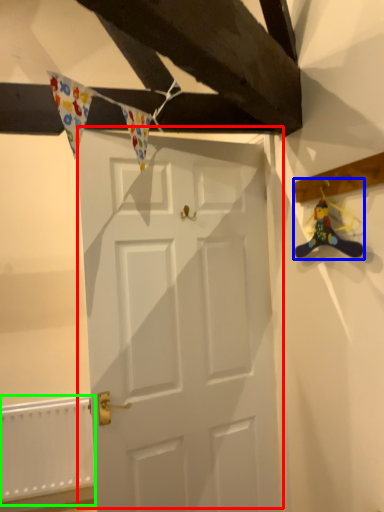
Question: Which object is positioned farthest from door (highlighted by a red box)? Select from miniature (highlighted by a blue box) and radiator (highlighted by a green box).

Choices:
 (A) miniature
 (B) radiator

Answer: (B)